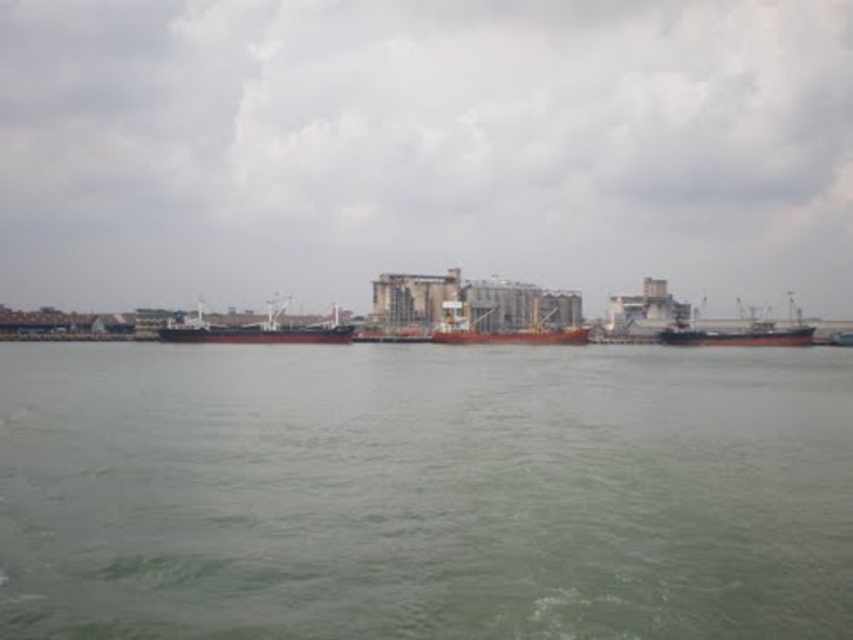
Can you confirm if dark gray matte ship at center is thinner than red matte cargo ship at center?

No.

Does dark gray matte ship at center have a smaller size compared to red matte cargo ship at center?

No.

You are a GUI agent. You are given a task and a screenshot of the screen. Output one action in this format:
    pyautogui.click(x=<x>, y=<y>)
    Task: Click on the dark gray matte ship at center
    This screenshot has height=640, width=853.
    Given the screenshot: What is the action you would take?
    pyautogui.click(x=257, y=330)

This screenshot has width=853, height=640. Find the location of `dark gray matte ship at center`. dark gray matte ship at center is located at coordinates (257, 330).

Does dark gray matte ship at center have a greater width compared to red matte ship at right?

Indeed, dark gray matte ship at center has a greater width compared to red matte ship at right.

Who is higher up, dark gray matte ship at center or red matte ship at right?

Positioned higher is dark gray matte ship at center.

Identify the location of dark gray matte ship at center. (257, 330).

Locate an element on the screen. dark gray matte ship at center is located at coordinates (257, 330).

Which is below, green water at center or red matte ship at right?

Positioned lower is green water at center.

Is point (532, 552) farther from viewer compared to point (753, 337)?

That is False.

Is point (759, 538) positioned behind point (776, 330)?

No, (759, 538) is closer to viewer.

The width and height of the screenshot is (853, 640). I want to click on green water at center, so click(x=424, y=492).